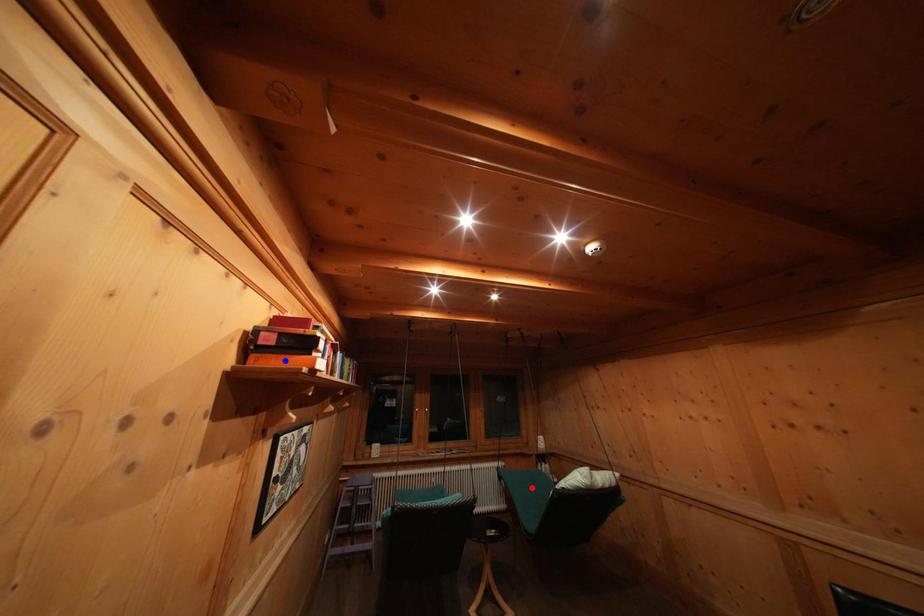
Question: Two points are marked on the image. Which point is closer to the camera?

Choices:
 (A) Blue point is closer.
 (B) Red point is closer.

Answer: (A)